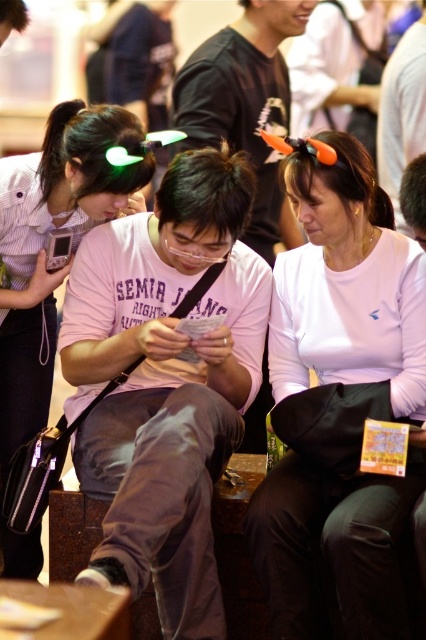
Question: Which object is farther from the camera taking this photo?

Choices:
 (A) white matte hairband at upper center
 (B) matte pink shirt at center

Answer: (B)

Question: Considering the relative positions of white matte hairband at upper center and matte pink shirt at center in the image provided, where is white matte hairband at upper center located with respect to matte pink shirt at center?

Choices:
 (A) left
 (B) right

Answer: (B)

Question: Which object appears closest to the camera in this image?

Choices:
 (A) white matte hairband at upper center
 (B) matte pink shirt at center

Answer: (A)

Question: Is white matte hairband at upper center below matte pink shirt at center?

Choices:
 (A) yes
 (B) no

Answer: (A)

Question: Observing the image, what is the correct spatial positioning of white matte hairband at upper center in reference to matte pink shirt at center?

Choices:
 (A) above
 (B) below

Answer: (B)